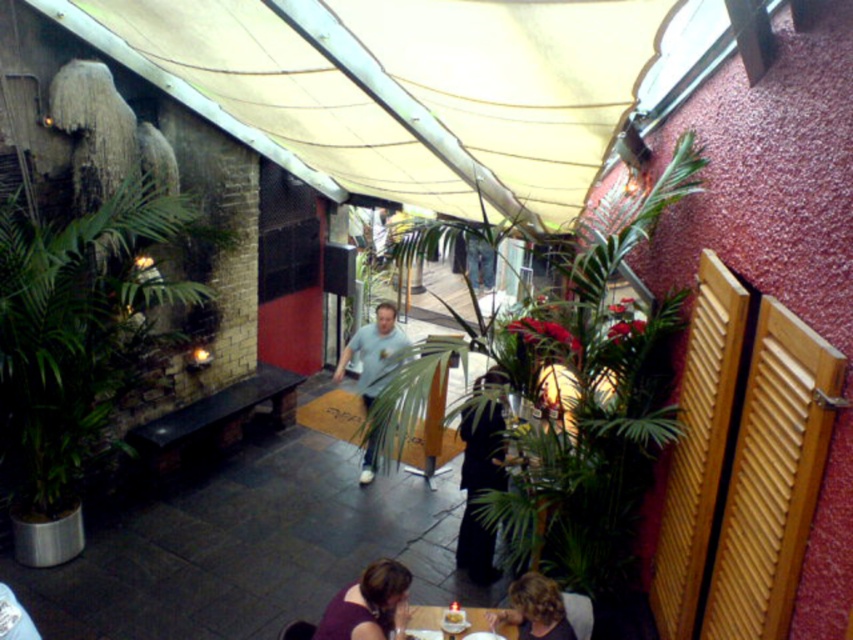
Who is more forward, (360, 61) or (500, 632)?

Point (500, 632) is in front.

Between beige fabric canopy at upper center and smooth wooden table at lower center, which one is positioned lower?

smooth wooden table at lower center is lower down.

Which is behind, point (549, 65) or point (444, 608)?

Point (444, 608)

Image resolution: width=853 pixels, height=640 pixels. Find the location of `beige fabric canopy at upper center`. beige fabric canopy at upper center is located at coordinates (398, 88).

Is point (527, 624) positioned before point (483, 630)?

Yes.

Is blonde hair at lower center taller than smooth wooden table at lower center?

Yes, blonde hair at lower center is taller than smooth wooden table at lower center.

What do you see at coordinates (534, 609) in the screenshot?
I see `blonde hair at lower center` at bounding box center [534, 609].

At what (x,y) coordinates should I click in order to perform the action: click on blonde hair at lower center. Please return your answer as a coordinate pair (x, y). The height and width of the screenshot is (640, 853). Looking at the image, I should click on (534, 609).

What are the coordinates of `beige fabric canopy at upper center` in the screenshot? It's located at (398, 88).

Can you confirm if beige fabric canopy at upper center is positioned below light blue t-shirt at center?

Incorrect, beige fabric canopy at upper center is not positioned below light blue t-shirt at center.

The image size is (853, 640). In order to click on beige fabric canopy at upper center in this screenshot , I will do `click(398, 88)`.

Find the location of `beige fabric canopy at upper center`. beige fabric canopy at upper center is located at coordinates pyautogui.click(x=398, y=88).